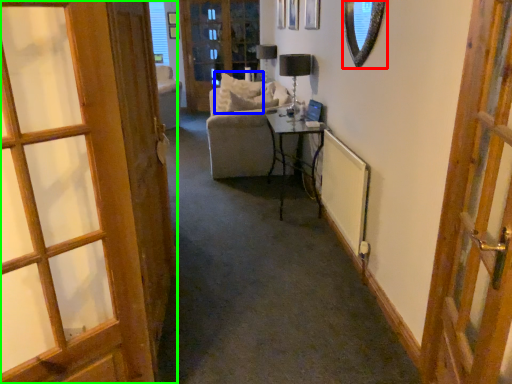
Question: Which object is positioned closest to mirror (highlighted by a red box)? Select from pillow (highlighted by a blue box) and door (highlighted by a green box).

Choices:
 (A) pillow
 (B) door

Answer: (B)